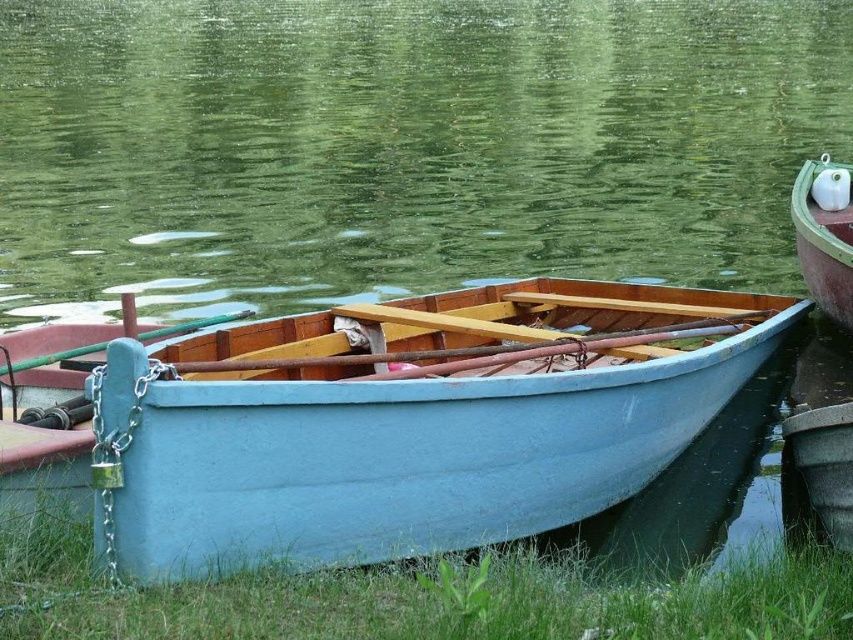
You are a photographer standing at the edge of the lake. You want to capture both the point at location (573, 588) and the point at (844, 236) in your photo. Which point should you focus on first to ensure both are in focus?

You should focus on point (573, 588) first because it is closer to the camera than point (844, 236), ensuring both points are within the depth of field.

You are an environmental scientist assessing water levels in the lake. You observe the green water at center and the light blue wood boat at center. Which one has a higher elevation in the scene?

The green water at center has a greater height compared to the light blue wood boat at center, so the green water at center is at a higher elevation.